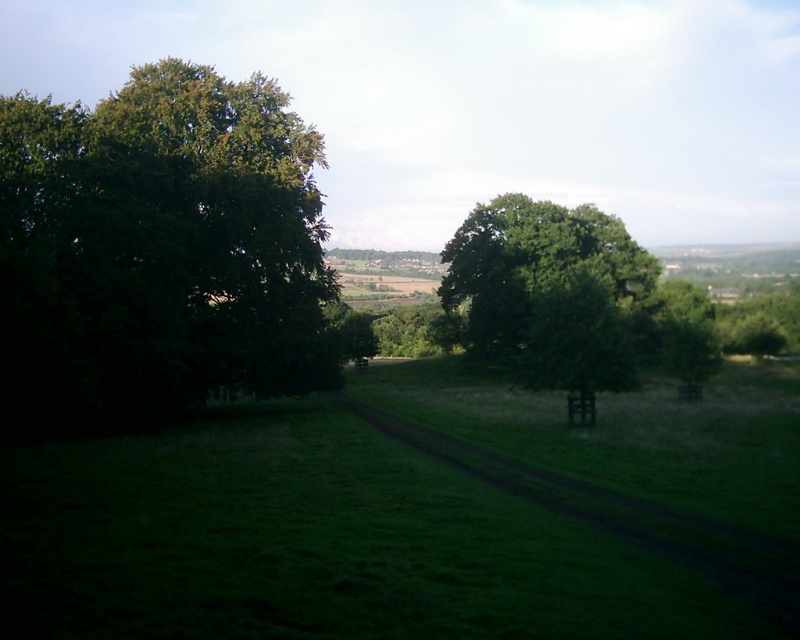
Is point (764, 497) closer to camera compared to point (108, 236)?

That is True.

What are the coordinates of `green grass at left` in the screenshot? It's located at (420, 516).

Is point (121, 566) behind point (84, 205)?

No, (121, 566) is in front of (84, 205).

Image resolution: width=800 pixels, height=640 pixels. What are the coordinates of `green grass at left` in the screenshot? It's located at (420, 516).

Is green leafy tree at left thinner than green leafy tree at center?

No.

Does green leafy tree at left lie behind green leafy tree at center?

No, it is in front of green leafy tree at center.

Does point (68, 269) lie behind point (517, 198)?

No.

Locate an element on the screen. This screenshot has width=800, height=640. green leafy tree at left is located at coordinates (160, 252).

In the scene shown: Which is more to the left, green grass at left or green leafy tree at center?

green grass at left

Can you confirm if green grass at left is positioned to the right of green leafy tree at center?

In fact, green grass at left is to the left of green leafy tree at center.

At what (x,y) coordinates should I click in order to perform the action: click on green grass at left. Please return your answer as a coordinate pair (x, y). This screenshot has width=800, height=640. Looking at the image, I should click on (420, 516).